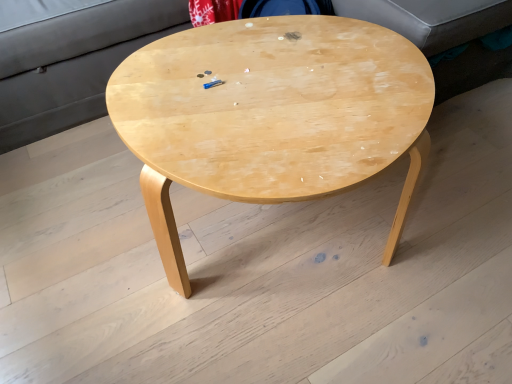
Find the location of a particular element. vacant area situated below natural wood coffee table at center (from a real-world perspective) is located at coordinates (293, 243).